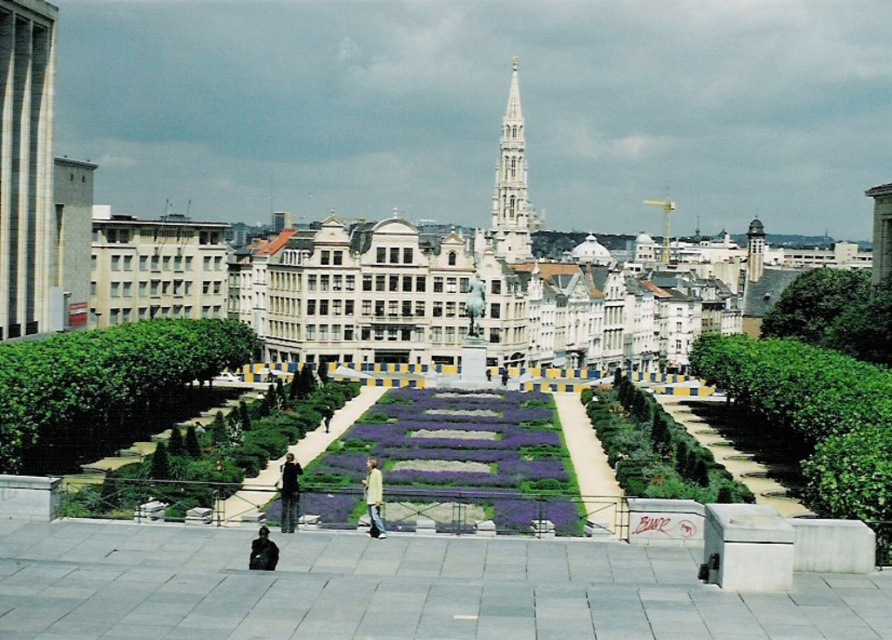
Can you confirm if white textured tower at left is bigger than white marble spire at center?

Incorrect, white textured tower at left is not larger than white marble spire at center.

At what (x,y) coordinates should I click in order to perform the action: click on white textured tower at left. Please return your answer as a coordinate pair (x, y). Image resolution: width=892 pixels, height=640 pixels. Looking at the image, I should click on (25, 163).

Is point (19, 312) farther from camera compared to point (504, 243)?

No, (19, 312) is in front of (504, 243).

In order to click on white textured tower at left in this screenshot , I will do `click(25, 163)`.